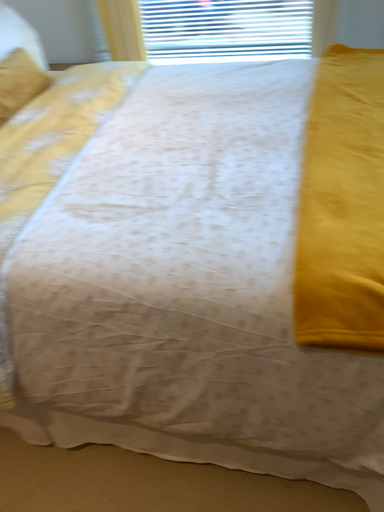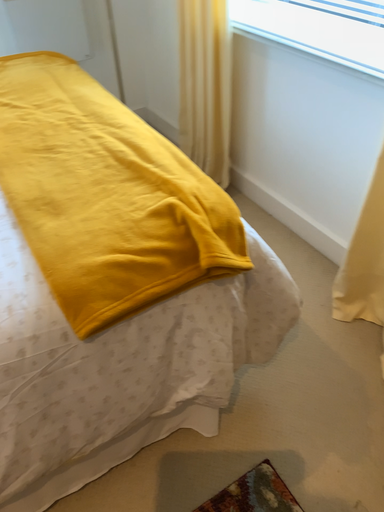
Question: Which way did the camera rotate in the video?

Choices:
 (A) rotated left
 (B) rotated right

Answer: (B)